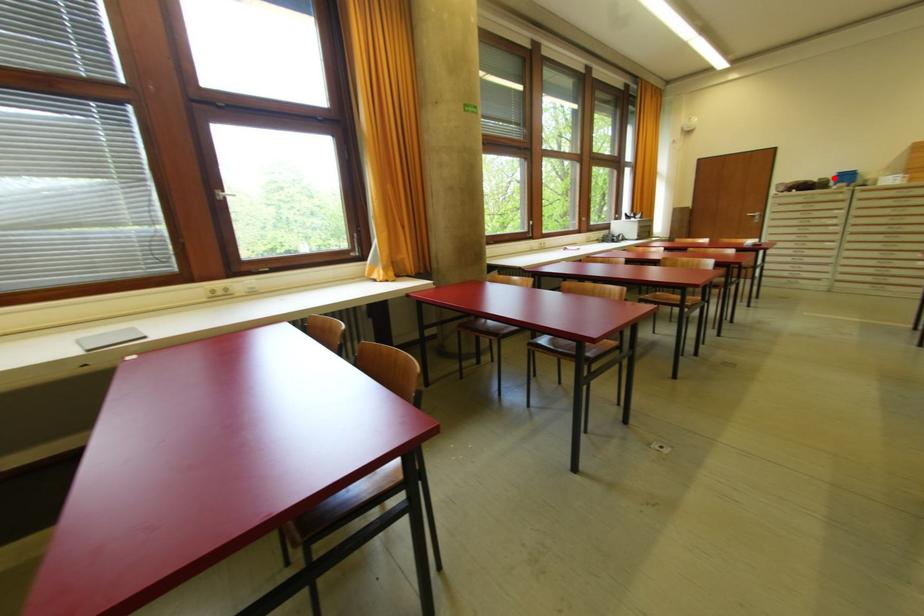
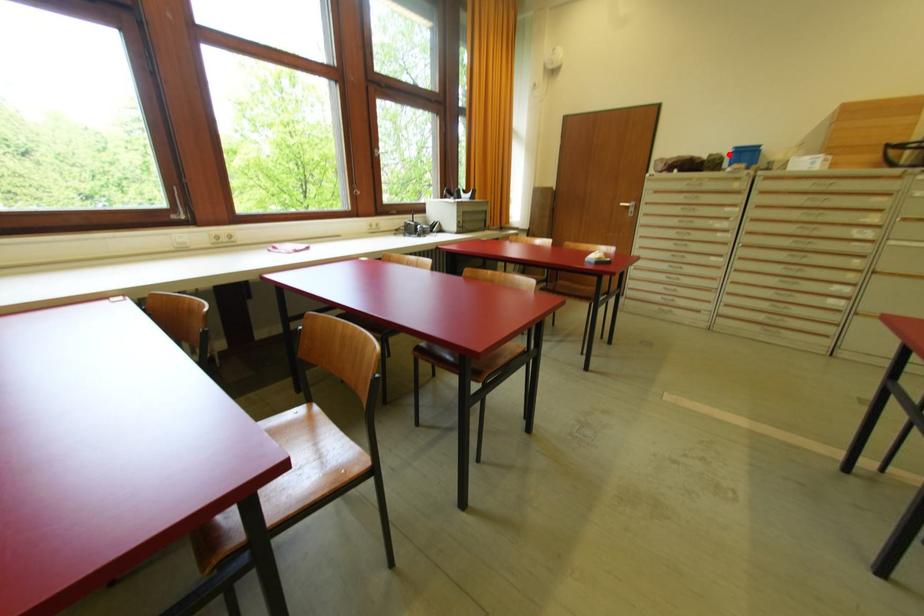
I am providing you with two images of the same scene from different viewpoints. A red point is marked on the first image and another point is marked on the second image. Are the points marked in image1 and image2 representing the same 3D position?

Yes